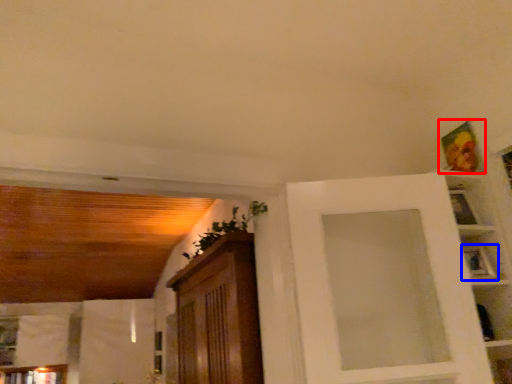
Question: Which point is further to the camera, picture frame (highlighted by a red box) or picture frame (highlighted by a blue box)?

Choices:
 (A) picture frame
 (B) picture frame

Answer: (A)